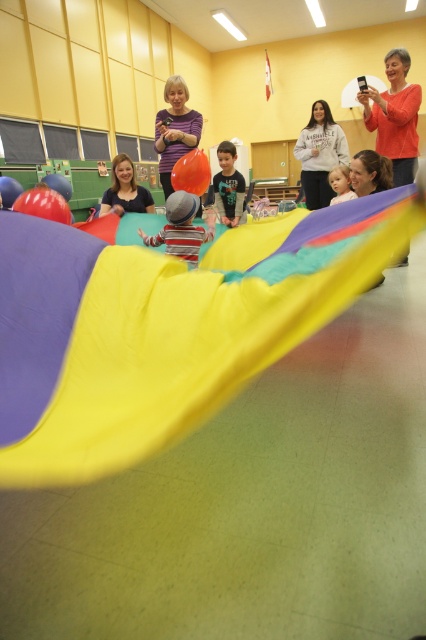
Question: Which point appears closest to the camera in this image?

Choices:
 (A) (186, 172)
 (B) (337, 188)
 (C) (226, 216)

Answer: (A)

Question: Considering the relative positions of rubber balloon at center and rubberized blue balloon at center in the image provided, where is rubber balloon at center located with respect to rubberized blue balloon at center?

Choices:
 (A) right
 (B) left

Answer: (B)

Question: Which point appears closest to the camera in this image?

Choices:
 (A) (316, 124)
 (B) (230, 173)
 (C) (204, 157)

Answer: (C)

Question: Does white fleece sweatshirt at center have a greater width compared to rubberized blue balloon at center?

Choices:
 (A) no
 (B) yes

Answer: (B)

Question: Where is purple matte shirt at center located in relation to matte black shirt at center in the image?

Choices:
 (A) left
 (B) right

Answer: (B)

Question: Based on their relative distances, which object is farther from the translucent orange balloon at center?

Choices:
 (A) striped cotton shirt at center
 (B) purple matte shirt at center
 (C) rubberized orange balloon at center

Answer: (C)